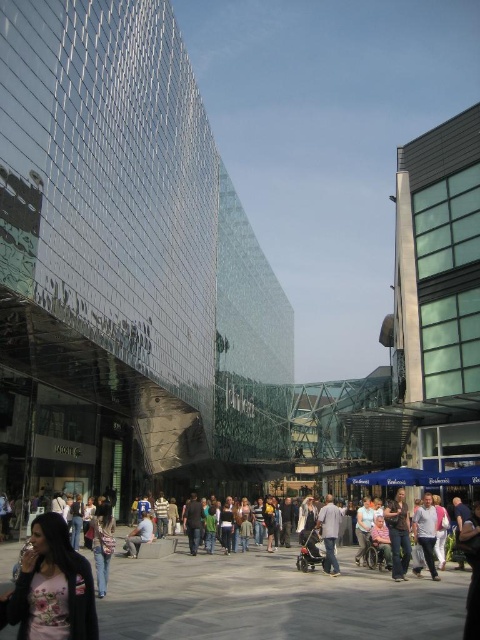
Question: Is floral fabric shirt at lower left positioned behind light gray fabric jacket at center?

Choices:
 (A) yes
 (B) no

Answer: (B)

Question: Considering the real-world distances, which object is closest to the light blue jeans at center?

Choices:
 (A) light brown leather jacket at center
 (B) light gray fabric jacket at center
 (C) floral fabric shirt at lower left

Answer: (B)

Question: Among these objects, which one is farthest from the camera?

Choices:
 (A) light gray fabric jacket at center
 (B) light blue jeans at center
 (C) light brown leather jacket at center
 (D) floral fabric shirt at lower left

Answer: (B)

Question: Can you confirm if floral fabric shirt at lower left is bigger than light brown leather jacket at center?

Choices:
 (A) yes
 (B) no

Answer: (A)

Question: Can you confirm if floral fabric shirt at lower left is positioned to the right of light brown leather jacket at center?

Choices:
 (A) yes
 (B) no

Answer: (B)

Question: Which point appears farthest from the camera in this image?

Choices:
 (A) (324, 572)
 (B) (402, 538)
 (C) (38, 596)
 (D) (139, 547)

Answer: (D)